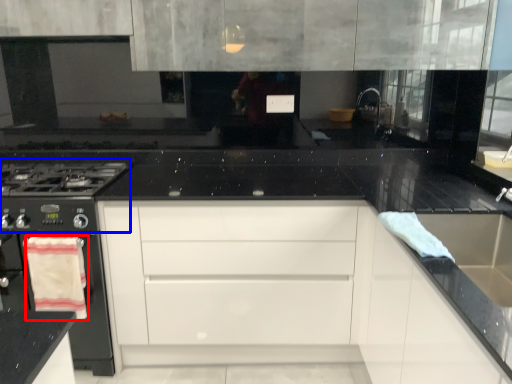
Question: Which of the following is the closest to the observer, material (highlighted by a red box) or gas stove (highlighted by a blue box)?

Choices:
 (A) material
 (B) gas stove

Answer: (B)